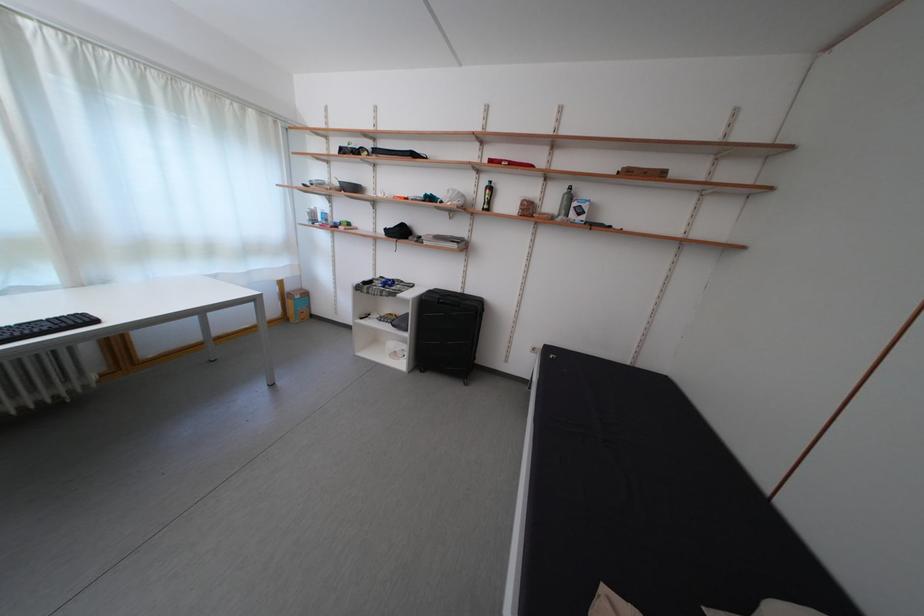
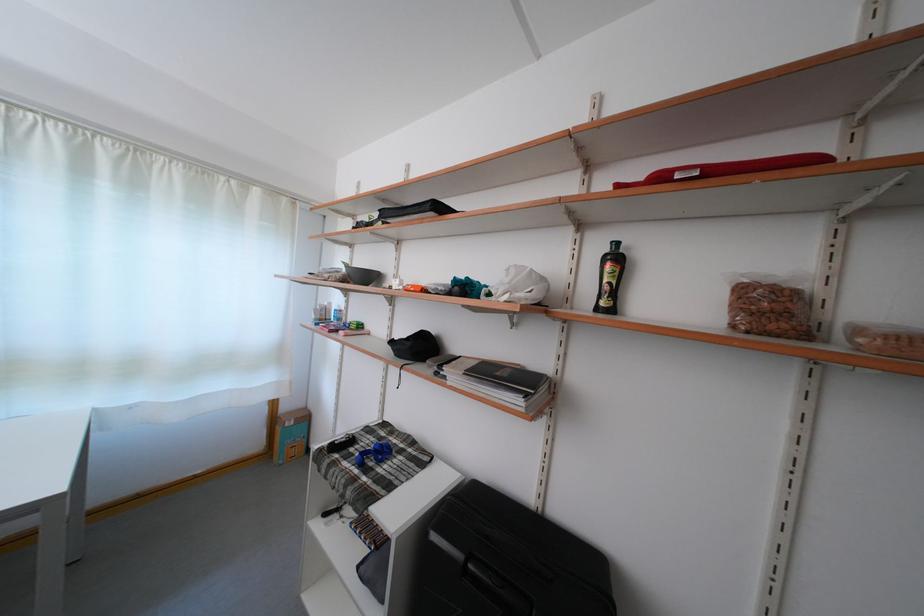
In the second image, find the point that corresponds to the point at 538,216 in the first image.

(782, 321)